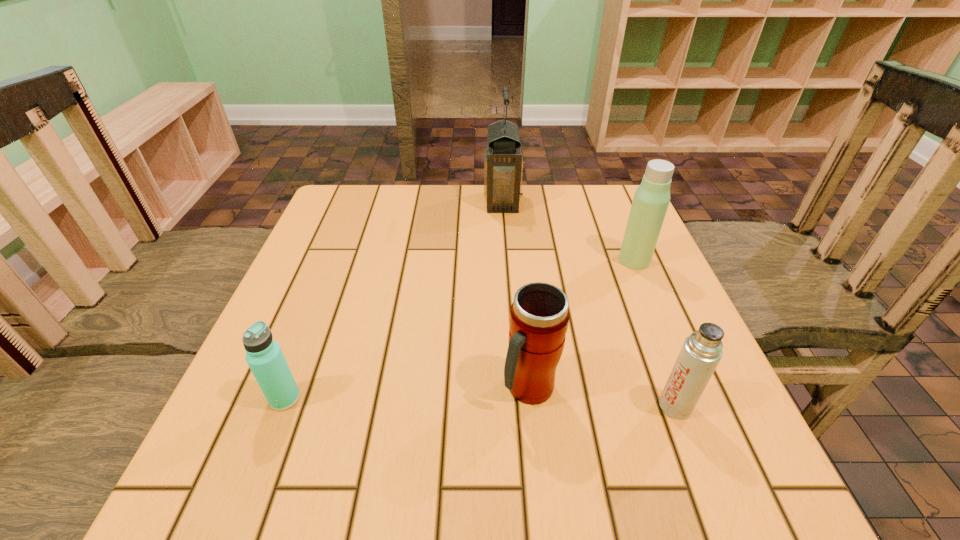
Locate an element on the screen. The width and height of the screenshot is (960, 540). vacant position located on the back of the leftmost thermos bottle is located at coordinates (303, 349).

I want to click on object situated at the far edge, so click(x=503, y=162).

This screenshot has width=960, height=540. I want to click on object that is at the left edge, so click(264, 356).

In the image, there is a desktop. Find the location of `vacant space at the far edge`. vacant space at the far edge is located at coordinates (405, 222).

Identify the location of blank space at the near edge of the desktop. (322, 462).

In the image, there is a desktop. Where is `free space at the left edge`? The image size is (960, 540). free space at the left edge is located at coordinates (324, 251).

The height and width of the screenshot is (540, 960). What are the coordinates of `blank area at the right edge` in the screenshot? It's located at (636, 377).

In order to click on vacant space at the far left corner in this screenshot , I will do `click(368, 200)`.

At what (x,y) coordinates should I click in order to perform the action: click on vacant space at the near left corner of the desktop. Please return your answer as a coordinate pair (x, y). Image resolution: width=960 pixels, height=540 pixels. Looking at the image, I should click on (291, 460).

At what (x,y) coordinates should I click in order to perform the action: click on vacant space at the far right corner of the desktop. Please return your answer as a coordinate pair (x, y). Looking at the image, I should click on (577, 185).